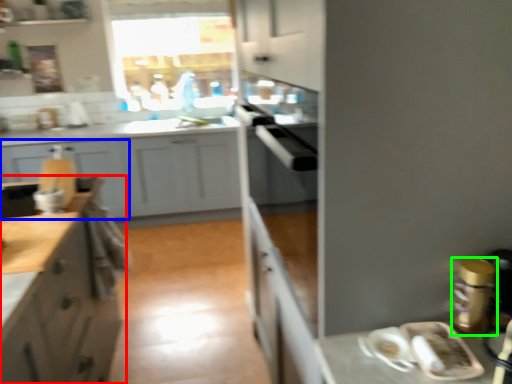
Question: Based on their relative distances, which object is farther from cabinetry (highlighted by a red box)? Choose from cabinetry (highlighted by a blue box) and appliance (highlighted by a green box).

Choices:
 (A) cabinetry
 (B) appliance

Answer: (A)